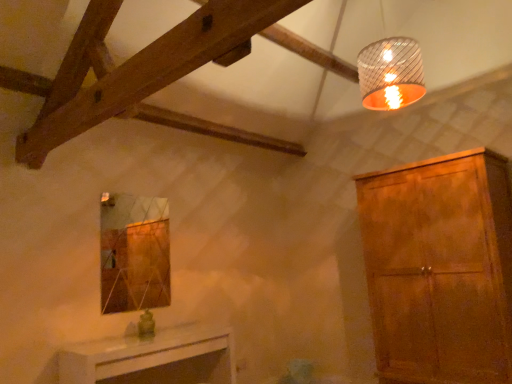
This screenshot has width=512, height=384. Describe the element at coordinates (391, 73) in the screenshot. I see `metallic ribbed lampshade at upper right` at that location.

Image resolution: width=512 pixels, height=384 pixels. Identify the location of metallic ribbed lampshade at upper right. (391, 73).

Describe the element at coordinates (440, 268) in the screenshot. I see `matte brown cabinet at right` at that location.

Find the location of a particular element. The height and width of the screenshot is (384, 512). white glossy table at lower center is located at coordinates (144, 353).

In the scene shown: Does matte brown cabinet at right appear on the right side of white glossy table at lower center?

Correct, you'll find matte brown cabinet at right to the right of white glossy table at lower center.

Is matte brown cabinet at right positioned far away from white glossy table at lower center?

Absolutely, matte brown cabinet at right is distant from white glossy table at lower center.

The image size is (512, 384). Identify the location of table below the matte brown cabinet at right (from a real-world perspective). (144, 353).

Is white glossy table at lower center located within matte brown cabinet at right?

Actually, white glossy table at lower center is outside matte brown cabinet at right.

The width and height of the screenshot is (512, 384). I want to click on lamp on the left of matte brown cabinet at right, so click(x=391, y=73).

Based on their positions, is metallic ribbed lampshade at upper right located to the left or right of matte brown cabinet at right?

Answer: metallic ribbed lampshade at upper right is positioned on matte brown cabinet at right's left side.

From the picture: How much distance is there between metallic ribbed lampshade at upper right and matte brown cabinet at right?

The distance of metallic ribbed lampshade at upper right from matte brown cabinet at right is 1.12 meters.

Are metallic ribbed lampshade at upper right and matte brown cabinet at right far apart?

That's right, there is a large distance between metallic ribbed lampshade at upper right and matte brown cabinet at right.

Image resolution: width=512 pixels, height=384 pixels. I want to click on lamp lying in front of the white glossy table at lower center, so click(391, 73).

Considering their positions, is metallic ribbed lampshade at upper right located in front of or behind white glossy table at lower center?

In the image, metallic ribbed lampshade at upper right appears in front of white glossy table at lower center.

Can white glossy table at lower center be found inside metallic ribbed lampshade at upper right?

No, white glossy table at lower center is not inside metallic ribbed lampshade at upper right.

Where is `lamp above the matte brown cabinet at right (from a real-world perspective)`? lamp above the matte brown cabinet at right (from a real-world perspective) is located at coordinates (391, 73).

From the image's perspective, which object appears higher, matte brown cabinet at right or metallic ribbed lampshade at upper right?

From the image's view, metallic ribbed lampshade at upper right is above.

Are matte brown cabinet at right and metallic ribbed lampshade at upper right making contact?

matte brown cabinet at right and metallic ribbed lampshade at upper right are not in contact.

Between matte brown cabinet at right and metallic ribbed lampshade at upper right, which one appears on the right side from the viewer's perspective?

matte brown cabinet at right.

Which object is closer to the camera, white glossy table at lower center or matte brown cabinet at right?

white glossy table at lower center.

Considering the relative sizes of white glossy table at lower center and matte brown cabinet at right in the image provided, is white glossy table at lower center bigger than matte brown cabinet at right?

Actually, white glossy table at lower center might be smaller than matte brown cabinet at right.

Could you tell me if white glossy table at lower center is turned towards matte brown cabinet at right?

No.

In order to click on cabinetry above the white glossy table at lower center (from the image's perspective) in this screenshot , I will do `click(440, 268)`.

Is white glossy table at lower center at the left side of metallic ribbed lampshade at upper right?

Yes.

From the image's perspective, which object appears higher, white glossy table at lower center or metallic ribbed lampshade at upper right?

metallic ribbed lampshade at upper right is shown above in the image.

Choose the correct answer: Is white glossy table at lower center inside metallic ribbed lampshade at upper right or outside it?

The correct answer is: outside.

Which of these two, white glossy table at lower center or metallic ribbed lampshade at upper right, stands shorter?

white glossy table at lower center is shorter.

The width and height of the screenshot is (512, 384). In order to click on table that appears below the matte brown cabinet at right (from a real-world perspective) in this screenshot , I will do `click(144, 353)`.

The image size is (512, 384). Find the location of `lamp that is in front of the matte brown cabinet at right`. lamp that is in front of the matte brown cabinet at right is located at coordinates coord(391,73).

Considering their positions, is metallic ribbed lampshade at upper right positioned closer to white glossy table at lower center than matte brown cabinet at right?

Among the two, matte brown cabinet at right is located nearer to white glossy table at lower center.

Which object lies nearer to the anchor point matte brown cabinet at right, metallic ribbed lampshade at upper right or white glossy table at lower center?

Based on the image, metallic ribbed lampshade at upper right appears to be nearer to matte brown cabinet at right.

Based on their spatial positions, is matte brown cabinet at right or white glossy table at lower center further from metallic ribbed lampshade at upper right?

white glossy table at lower center lies further to metallic ribbed lampshade at upper right than the other object.

Considering their positions, is white glossy table at lower center positioned further to matte brown cabinet at right than metallic ribbed lampshade at upper right?

white glossy table at lower center.

Based on their spatial positions, is white glossy table at lower center or matte brown cabinet at right further from metallic ribbed lampshade at upper right?

white glossy table at lower center lies further to metallic ribbed lampshade at upper right than the other object.

Which object lies nearer to the anchor point white glossy table at lower center, matte brown cabinet at right or metallic ribbed lampshade at upper right?

matte brown cabinet at right is closer to white glossy table at lower center.

Identify the location of cabinetry between metallic ribbed lampshade at upper right and white glossy table at lower center in the vertical direction. This screenshot has height=384, width=512. (440, 268).